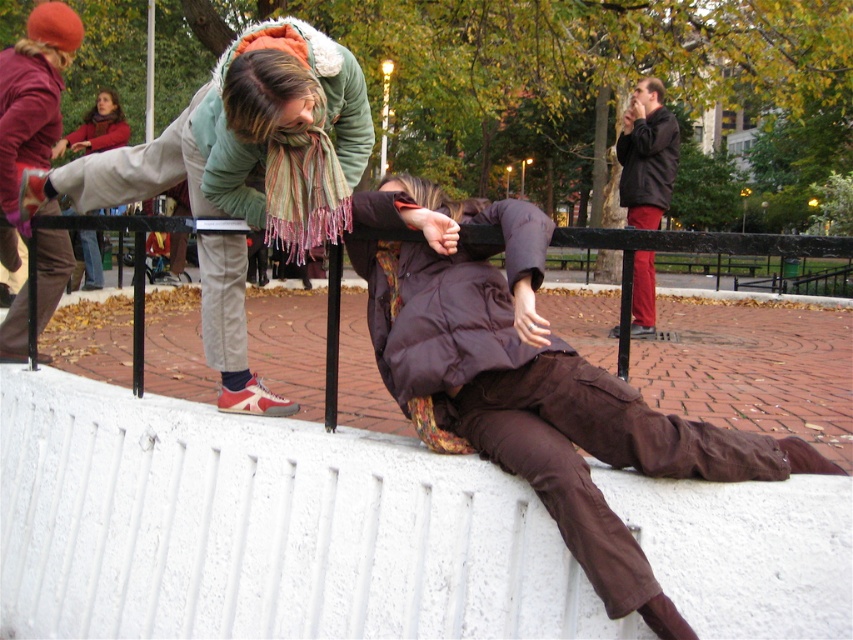
You are a photographer trying to capture a candid shot of two people interacting near the white wall. The subjects are wearing a brown matte jacket at center and a green fleece jacket at upper center. Given that your camera has a maximum focus range of 30 inches, will you be able to keep both subjects in focus simultaneously?

The brown matte jacket at center and green fleece jacket at upper center are 30.85 inches apart from each other. Since the distance between them exceeds the camera lens focus range of 30 inches, the camera cannot keep both subjects in focus at the same time.